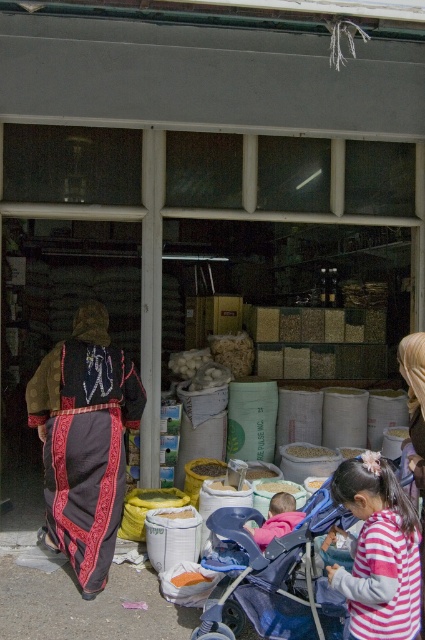
Question: Does dark brown fabric at left appear over white matte rice at center?

Choices:
 (A) yes
 (B) no

Answer: (A)

Question: Which point is farther to the camera?

Choices:
 (A) pink fabric baby carriage at center
 (B) dark brown fabric at left
 (C) smooth yellow powder at center

Answer: (C)

Question: Which point is closer to the camera?

Choices:
 (A) tap(161, 512)
 (B) tap(266, 481)

Answer: (A)

Question: In this image, where is striped cotton shirt at center located relative to smooth plastic container at center?

Choices:
 (A) below
 (B) above

Answer: (B)

Question: Does blue plastic baby carriage at center have a larger size compared to smooth yellow powder at center?

Choices:
 (A) yes
 (B) no

Answer: (A)

Question: Which object appears farthest from the camera in this image?

Choices:
 (A) smooth plastic container at center
 (B) dark brown fabric at left
 (C) striped cotton shirt at center
 (D) pink fabric baby carriage at center

Answer: (A)